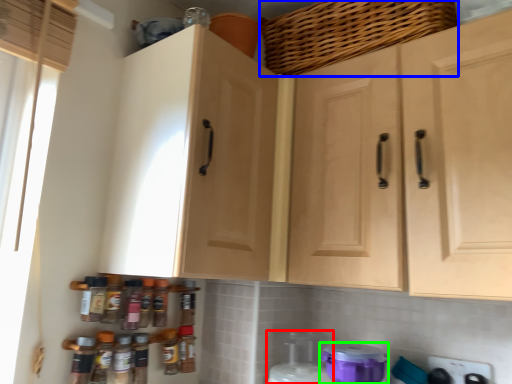
Question: Which object is positioned farthest from appliance (highlighted by a red box)? Select from basket (highlighted by a blue box) and appliance (highlighted by a green box).

Choices:
 (A) basket
 (B) appliance

Answer: (A)